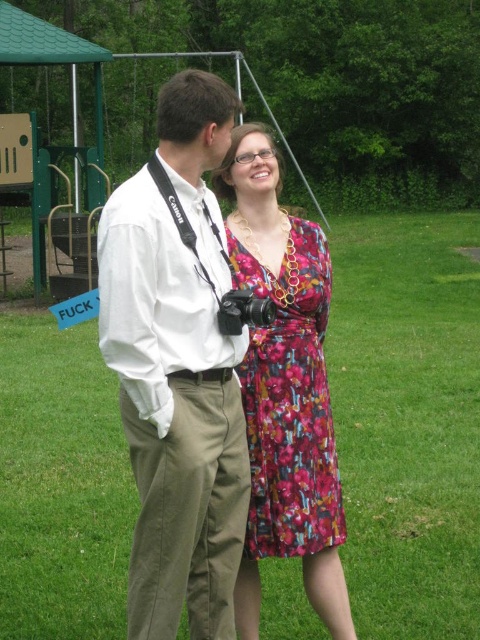
Between green grass at center and white cotton shirt at center, which one is positioned lower?

green grass at center is lower down.

Between green grass at center and white cotton shirt at center, which one has less height?

With less height is white cotton shirt at center.

Is point (383, 520) behind point (163, 500)?

Yes, it is.

This screenshot has height=640, width=480. I want to click on green grass at center, so click(x=408, y=420).

Is the position of green grass at center more distant than that of floral silk dress at center?

Yes.

Looking at this image, who is more forward, (27, 464) or (276, 467)?

Point (276, 467)

Who is more distant from viewer, (66, 627) or (252, 349)?

The point (66, 627) is more distant.

Where is `green grass at center`? The width and height of the screenshot is (480, 640). green grass at center is located at coordinates (408, 420).

Does white cotton shirt at center appear on the right side of floral silk dress at center?

Incorrect, white cotton shirt at center is not on the right side of floral silk dress at center.

Is point (199, 390) farther from camera compared to point (303, 451)?

No, it is not.

Find the location of a particular element. This screenshot has width=480, height=640. white cotton shirt at center is located at coordinates (178, 371).